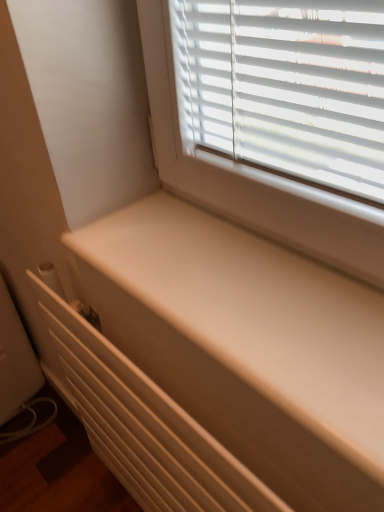
What do you see at coordinates (145, 426) in the screenshot?
I see `white matte radiator at lower left` at bounding box center [145, 426].

You are a GUI agent. You are given a task and a screenshot of the screen. Output one action in this format:
    pyautogui.click(x=<x>, y=<y>)
    Task: Click on the white matte radiator at lower left
    The image size is (384, 512).
    Given the screenshot: What is the action you would take?
    pyautogui.click(x=145, y=426)

You are a GUI agent. You are given a task and a screenshot of the screen. Output one action in this format:
    pyautogui.click(x=<x>, y=<y>)
    Task: Click on the white matte radiator at lower left
    This screenshot has width=384, height=512.
    Given the screenshot: What is the action you would take?
    pyautogui.click(x=145, y=426)